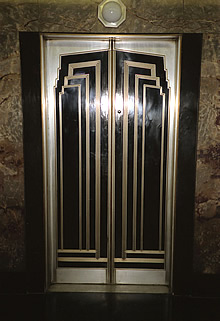
The width and height of the screenshot is (220, 321). In order to click on black and white striped elevator door in this screenshot , I will do `click(101, 123)`, `click(104, 225)`, `click(117, 216)`, `click(114, 215)`.